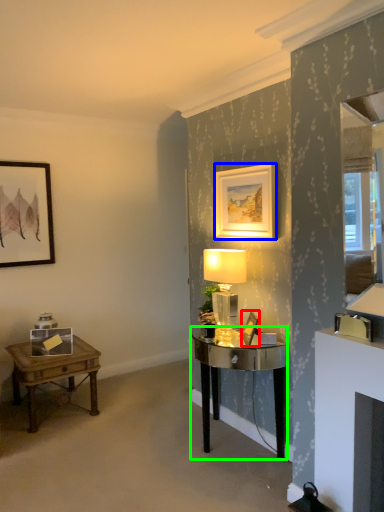
Question: Considering the real-world distances, which object is closest to picture frame (highlighted by a red box)? picture frame (highlighted by a blue box) or desk (highlighted by a green box).

Choices:
 (A) picture frame
 (B) desk

Answer: (B)